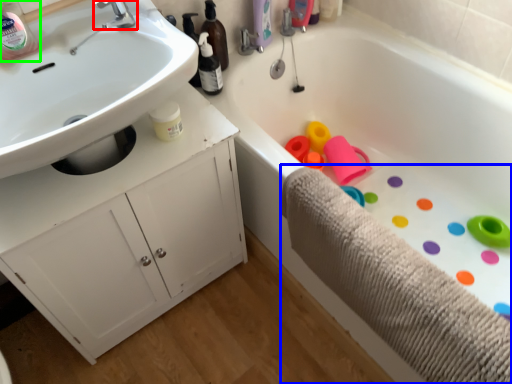
Question: Considering the real-world distances, which object is farthest from tap (highlighted by a red box)? bath towel (highlighted by a blue box) or bottle (highlighted by a green box)?

Choices:
 (A) bath towel
 (B) bottle

Answer: (A)